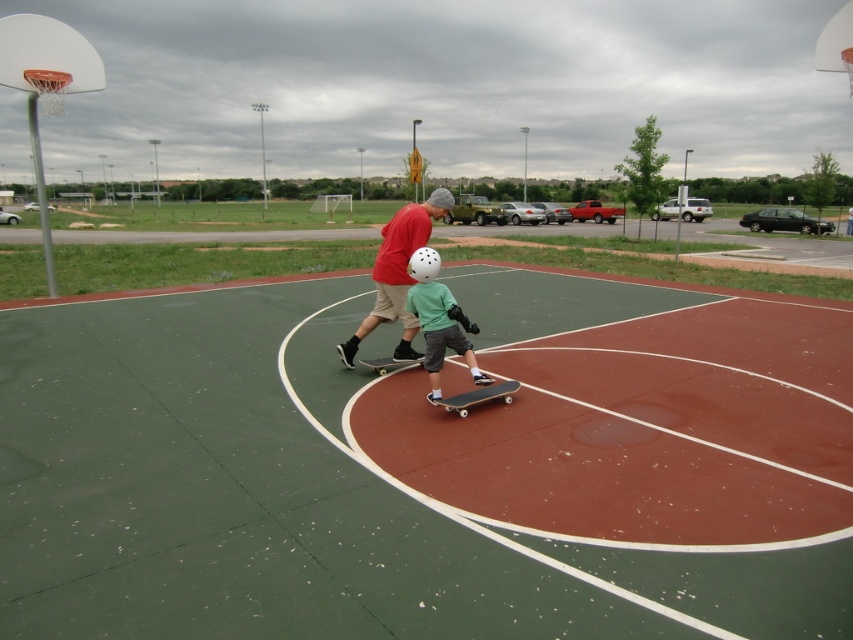
Can you confirm if white plastic basketball hoop at upper left is taller than metallic silver skateboard at center?

Yes.

What are the coordinates of `white plastic basketball hoop at upper left` in the screenshot? It's located at (45, 84).

The width and height of the screenshot is (853, 640). I want to click on white plastic basketball hoop at upper left, so click(45, 84).

Who is more forward, (399, 240) or (430, 372)?

Positioned in front is point (430, 372).

The width and height of the screenshot is (853, 640). Describe the element at coordinates (397, 273) in the screenshot. I see `matte black skateboard at center` at that location.

Measure the distance between point (403, 292) and camera.

Point (403, 292) and camera are 7.27 meters apart.

Locate an element on the screen. This screenshot has width=853, height=640. matte black skateboard at center is located at coordinates (397, 273).

Is point (387, 310) less distant than point (471, 392)?

No, it is not.

This screenshot has height=640, width=853. Describe the element at coordinates (397, 273) in the screenshot. I see `matte black skateboard at center` at that location.

Is point (384, 227) positioned after point (457, 403)?

Yes, it is behind point (457, 403).

At what (x,y) coordinates should I click in order to perform the action: click on matte black skateboard at center. Please return your answer as a coordinate pair (x, y). Looking at the image, I should click on (397, 273).